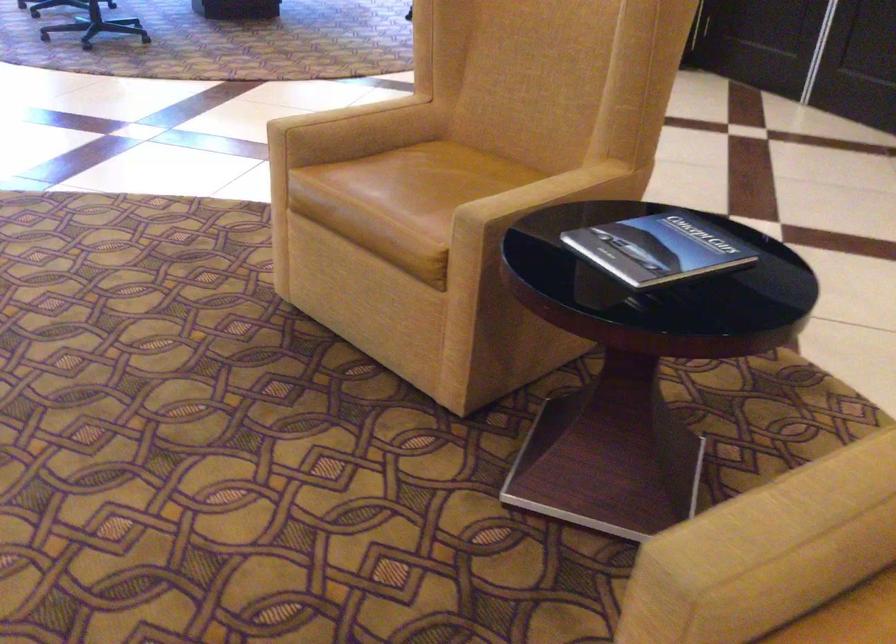
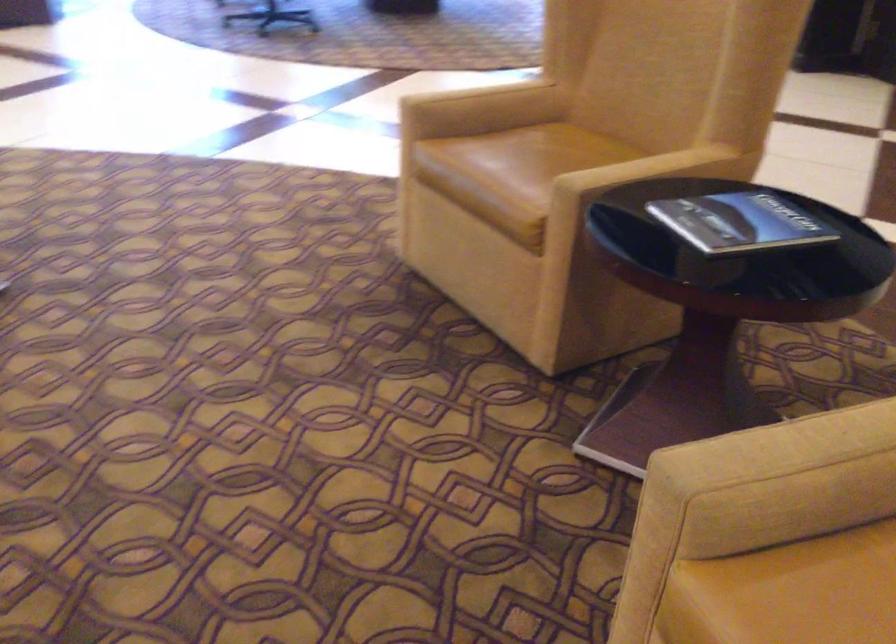
Find the pixel in the second image that matches [329,100] in the first image.

(478, 91)